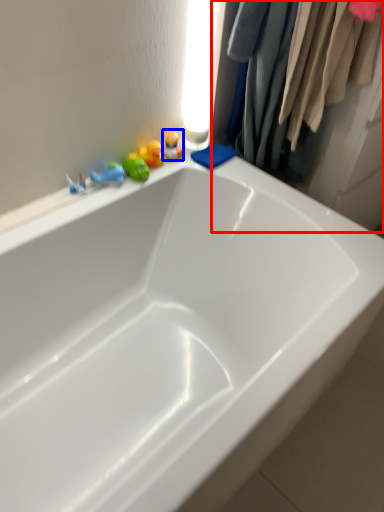
Question: Which object appears farthest to the camera in this image, closet (highlighted by a red box) or toy (highlighted by a blue box)?

Choices:
 (A) closet
 (B) toy

Answer: (B)